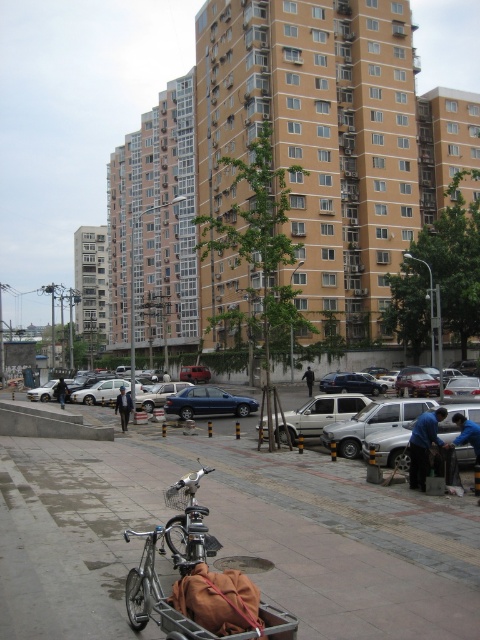
Question: Which object is the farthest from the dark blue fabric at center?

Choices:
 (A) silver metallic sedan at center
 (B) black suit at center

Answer: (B)

Question: Which point is closer to the camera taking this photo?

Choices:
 (A) (290, 637)
 (B) (184, 486)
 (C) (311, 385)
 (D) (477, 435)

Answer: (A)

Question: Is silver metallic sedan at center smaller than black leather jacket at lower left?

Choices:
 (A) no
 (B) yes

Answer: (A)

Question: Can you confirm if concrete sidewalk at center is positioned below blue fabric jacket at lower right?

Choices:
 (A) no
 (B) yes

Answer: (B)

Question: Which of the following is the closest to the observer?

Choices:
 (A) (64, 500)
 (B) (205, 556)
 (C) (181, 483)

Answer: (B)

Question: Can you confirm if silver metallic sedan at center is positioned to the left of dark blue fabric at center?

Choices:
 (A) yes
 (B) no

Answer: (A)